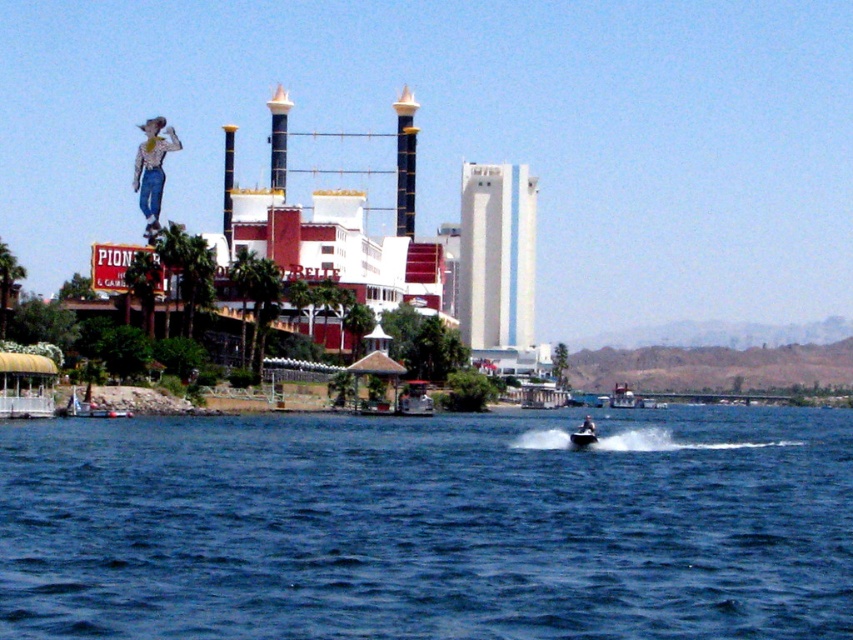
Question: Is the position of blue water at center less distant than that of dark blue fabric boat at lower right?

Choices:
 (A) yes
 (B) no

Answer: (A)

Question: Does denim jeans cowboy at upper left have a smaller size compared to metallic silver jet ski at lower center?

Choices:
 (A) no
 (B) yes

Answer: (A)

Question: Which object is farther from the camera taking this photo?

Choices:
 (A) dark blue fabric boat at lower right
 (B) denim jeans cowboy at upper left
 (C) metallic silver jet ski at lower center

Answer: (B)

Question: Which point is farther to the camera?

Choices:
 (A) blue water at center
 (B) metallic silver jet ski at lower center
 (C) denim jeans cowboy at upper left

Answer: (C)

Question: Considering the relative positions of blue water at center and dark blue fabric boat at lower right in the image provided, where is blue water at center located with respect to dark blue fabric boat at lower right?

Choices:
 (A) below
 (B) above

Answer: (B)

Question: Among these points, which one is nearest to the camera?

Choices:
 (A) (149, 150)
 (B) (450, 492)

Answer: (B)